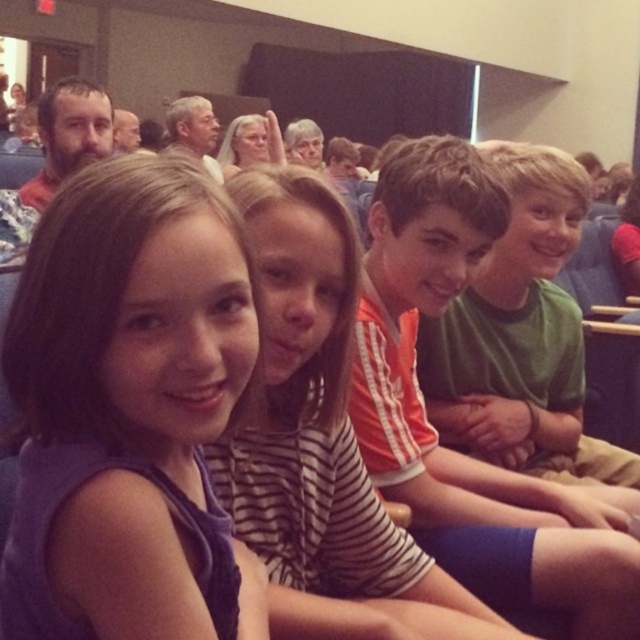
Question: Where is striped shirt at center located in relation to green matte shirt at center in the image?

Choices:
 (A) above
 (B) below

Answer: (B)

Question: Among these objects, which one is farthest from the camera?

Choices:
 (A) striped shirt at center
 (B) matte black hair at upper left
 (C) green matte shirt at center

Answer: (B)

Question: Is striped shirt at center to the right of matte black hair at upper left from the viewer's perspective?

Choices:
 (A) no
 (B) yes

Answer: (B)

Question: Which point is farther to the camera?

Choices:
 (A) (557, 435)
 (B) (296, 451)
 (C) (74, 106)

Answer: (C)

Question: Can you confirm if matte black hair at upper left is bigger than matte black beard at upper left?

Choices:
 (A) yes
 (B) no

Answer: (B)

Question: Which object appears farthest from the camera in this image?

Choices:
 (A) matte black hair at upper left
 (B) green matte shirt at center
 (C) matte black beard at upper left

Answer: (C)